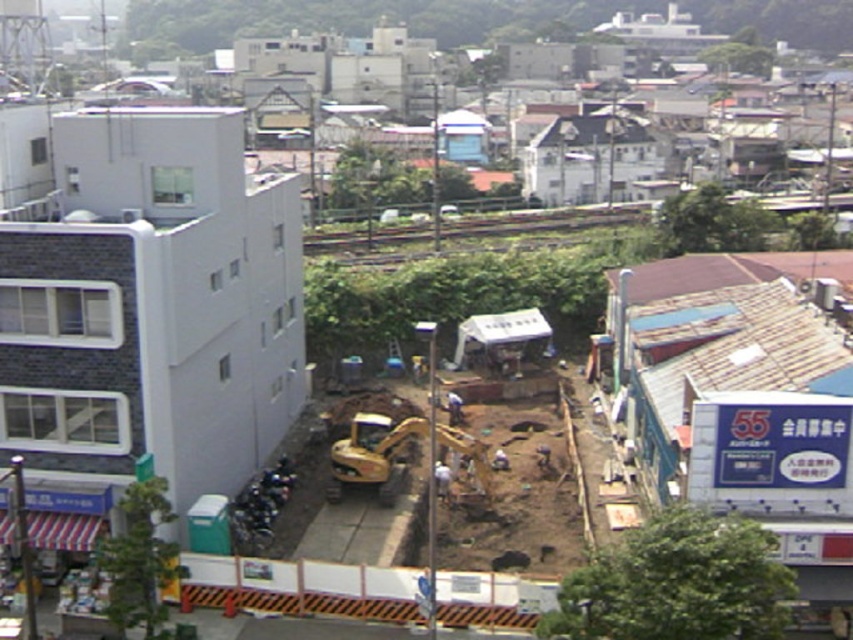
Which is more to the right, yellow metallic excavator at center or white fabric construction worker at center?

Positioned to the right is white fabric construction worker at center.

Which is behind, point (483, 492) or point (439, 481)?

The point (439, 481) is more distant.

Identify the location of yellow metallic excavator at center. This screenshot has height=640, width=853. (374, 452).

Measure the distance between white matte building at left and white fabric construction worker at center.

white matte building at left and white fabric construction worker at center are 11.21 meters apart.

Is point (36, 230) farther from viewer compared to point (439, 467)?

No, (36, 230) is closer to viewer.

Identify the location of white matte building at left. (151, 305).

Between white matte building at left and yellow metallic excavator at center, which one appears on the left side from the viewer's perspective?

Positioned to the left is white matte building at left.

Is white matte building at left taller than yellow metallic excavator at center?

Yes, white matte building at left is taller than yellow metallic excavator at center.

Does point (186, 200) come closer to viewer compared to point (405, 438)?

That is True.

Locate an element on the screen. This screenshot has width=853, height=640. white matte building at left is located at coordinates (151, 305).